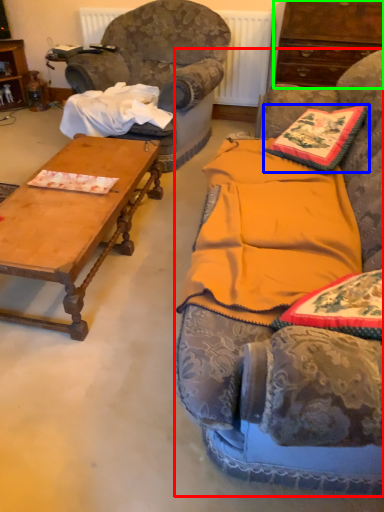
Question: Which object is positioned closest to studio couch (highlighted by a red box)? Select from pillow (highlighted by a blue box) and cabinetry (highlighted by a green box).

Choices:
 (A) pillow
 (B) cabinetry

Answer: (A)